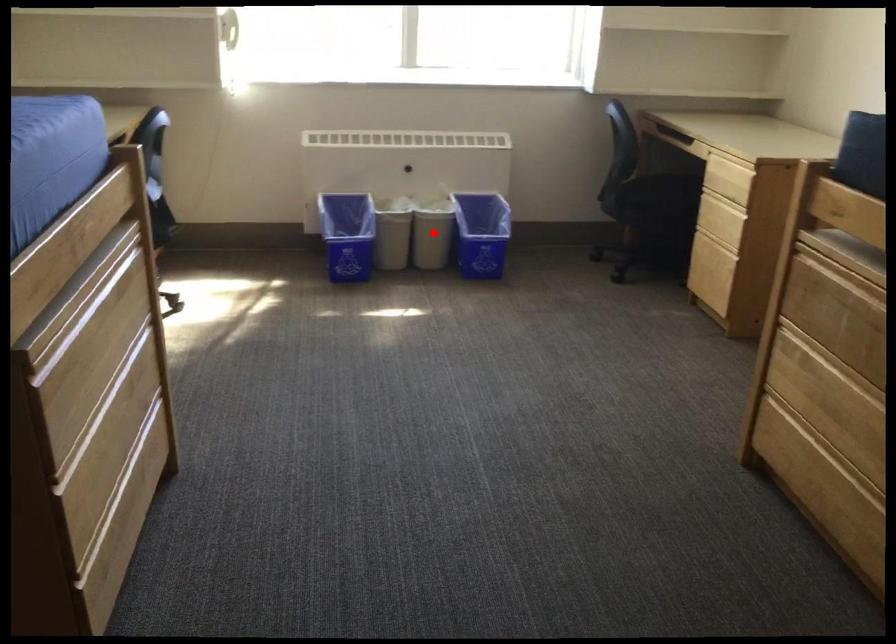
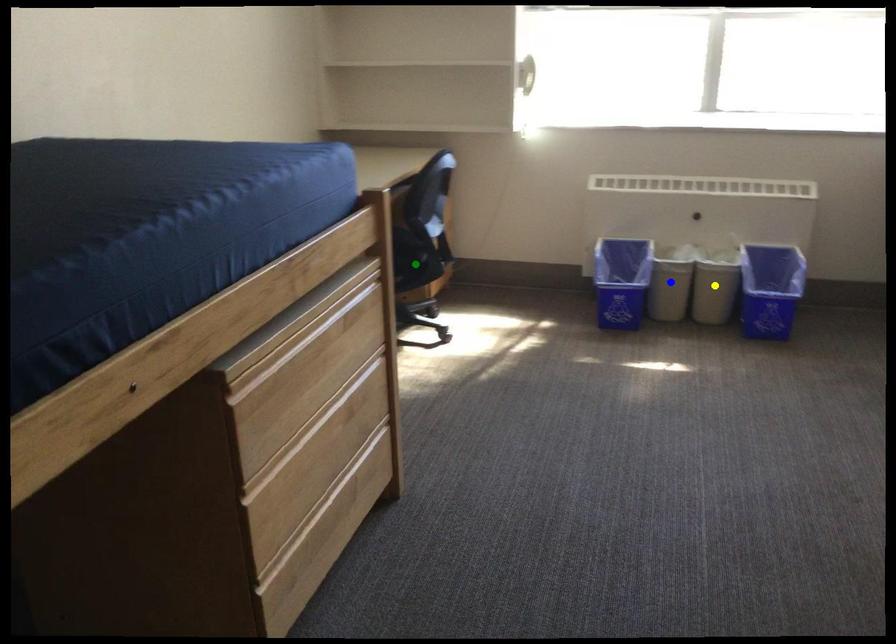
Question: I am providing you with two images of the same scene from different viewpoints. A red point is marked on the first image. You are given multiple points on the second image. Can you choose the point in image 2 that corresponds to the point in image 1?

Choices:
 (A) yellow point
 (B) green point
 (C) blue point

Answer: (A)